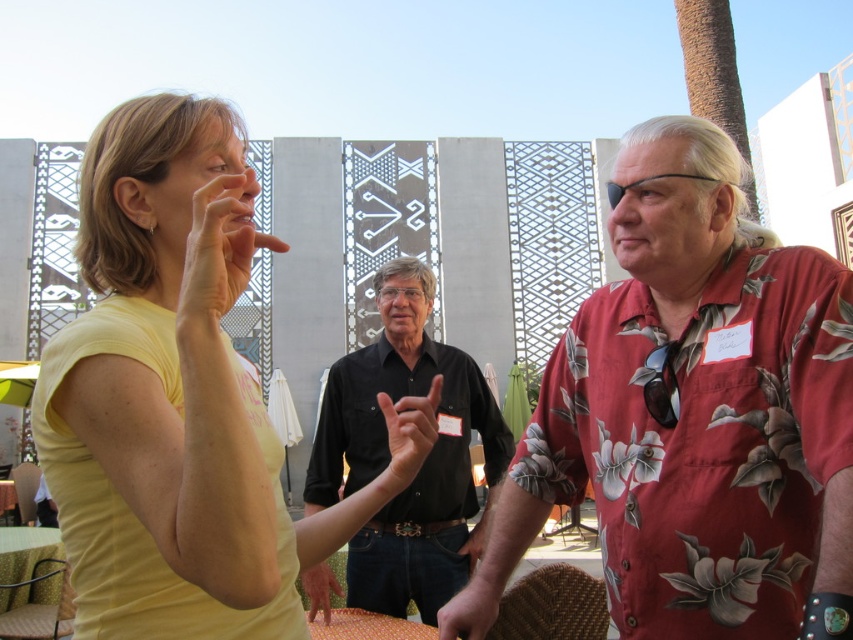
You are a photographer trying to capture a candid shot of the two hands in the scene. The matte yellow hand at upper center and the matte black hand at center are both visible. Which hand should you focus on if you want to capture the larger one in your frame?

The matte yellow hand at upper center is bigger than the matte black hand at center, so you should focus on the matte yellow hand at upper center to capture the larger one in your frame.

In the scene, there are a floral print shirt at right and a smooth skin hand at center. Which object is positioned to the right of the other?

The floral print shirt at right is to the right of the smooth skin hand at center.

You are a photographer trying to capture a candid shot of the two people in the scene. You notice the matte yellow hand at upper center and the smooth skin hand at center. Which hand should you focus on to ensure it appears in front of the other in the photo?

The matte yellow hand at upper center is in front of the smooth skin hand at center, so focusing on the matte yellow hand at upper center will ensure it appears in front in the photo.